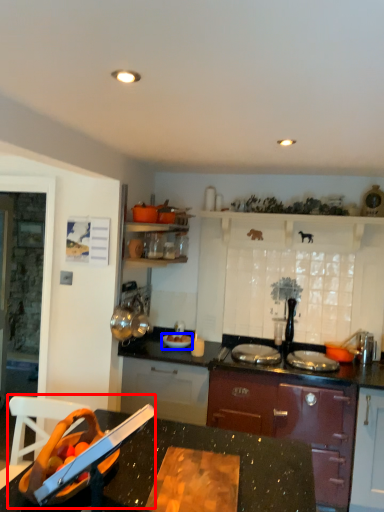
Question: Which object is further to the camera taking this photo, sink (highlighted by a red box) or kitchen appliance (highlighted by a blue box)?

Choices:
 (A) sink
 (B) kitchen appliance

Answer: (B)